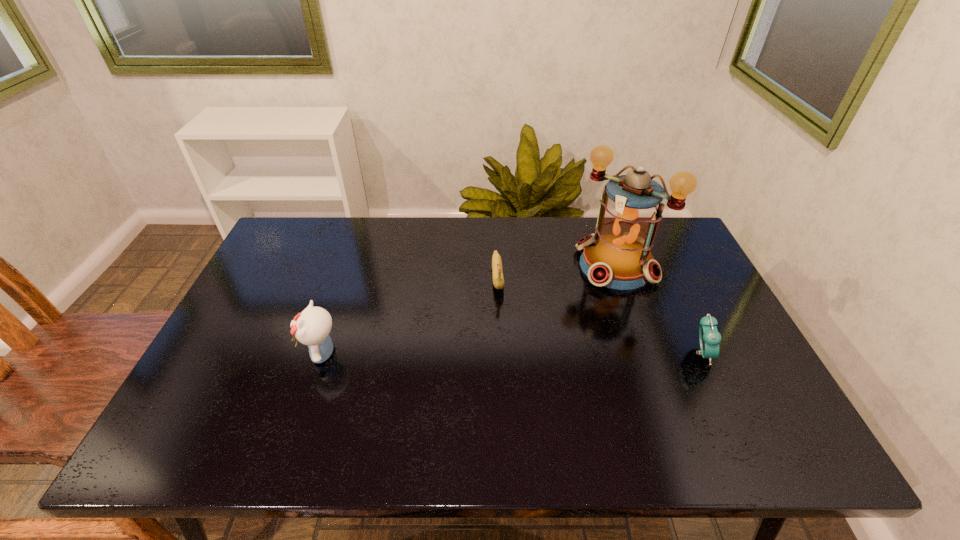
The width and height of the screenshot is (960, 540). What are the coordinates of `vacant spot on the desktop that is between the kitten and the alarm clock and is positioned on the front-facing side of the tallest object` in the screenshot? It's located at (531, 353).

This screenshot has height=540, width=960. Find the location of `free space on the desktop that is between the kitten and the alarm clock and is positioned at the stem of the third object from right to left`. free space on the desktop that is between the kitten and the alarm clock and is positioned at the stem of the third object from right to left is located at coordinates (504, 353).